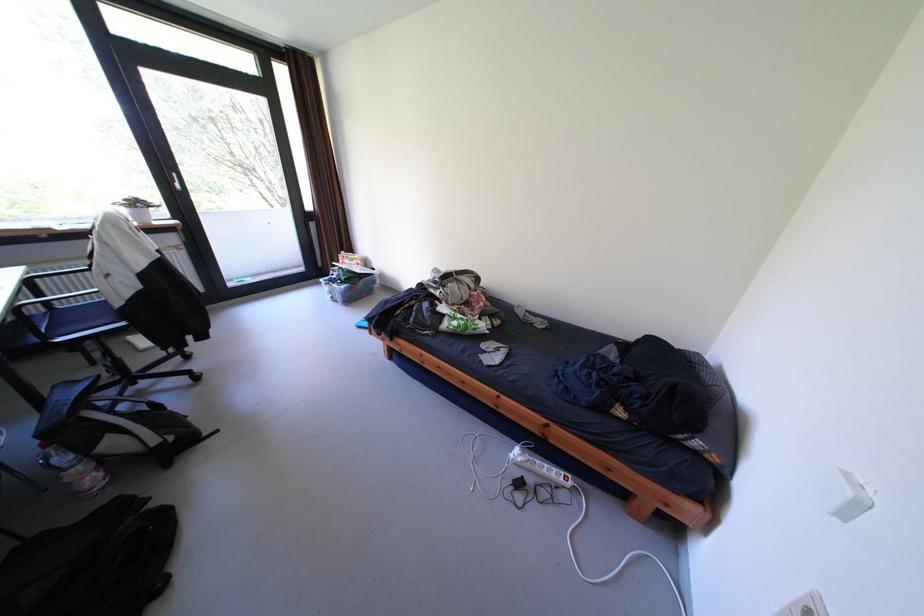
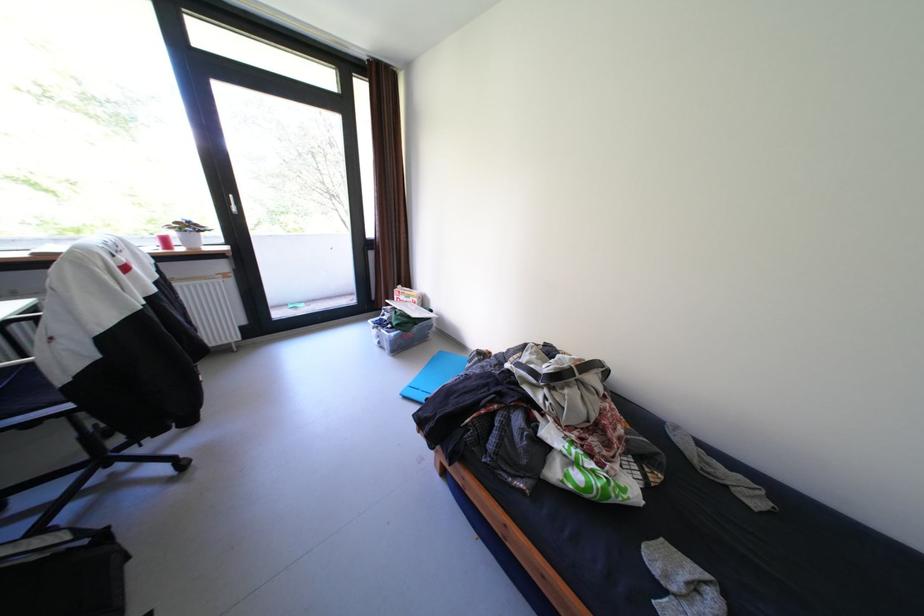
Question: The images are taken continuously from a first-person perspective. In which direction is your viewpoint rotating?

Choices:
 (A) Left
 (B) Right
 (C) Up
 (D) Down

Answer: (A)